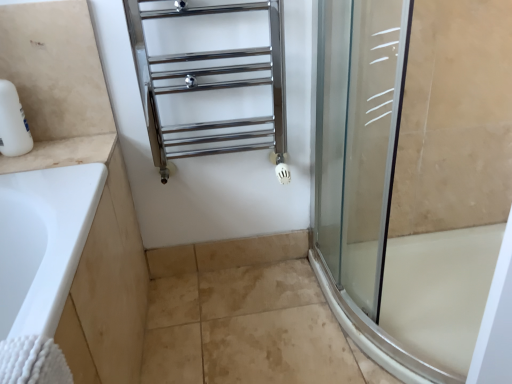
Question: Is white marble counter at left bigger or smaller than polished chrome towel rack at upper center?

Choices:
 (A) small
 (B) big

Answer: (A)

Question: From the image's perspective, is white marble counter at left located above or below polished chrome towel rack at upper center?

Choices:
 (A) below
 (B) above

Answer: (A)

Question: Estimate the real-world distances between objects in this image. Which object is closer to the polished chrome towel rack at upper center?

Choices:
 (A) beige tile at lower center
 (B) white marble counter at left

Answer: (B)

Question: Considering the real-world distances, which object is closest to the white marble counter at left?

Choices:
 (A) polished chrome towel rack at upper center
 (B) beige tile at lower center

Answer: (A)